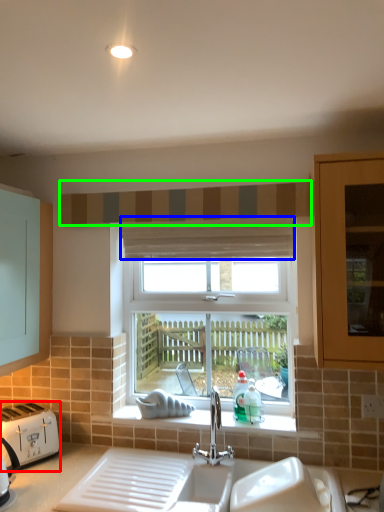
Question: Estimate the real-world distances between objects in this image. Which object is closer to toaster (highlighted by a red box), curtain (highlighted by a blue box) or curtain (highlighted by a green box)?

Choices:
 (A) curtain
 (B) curtain

Answer: (A)